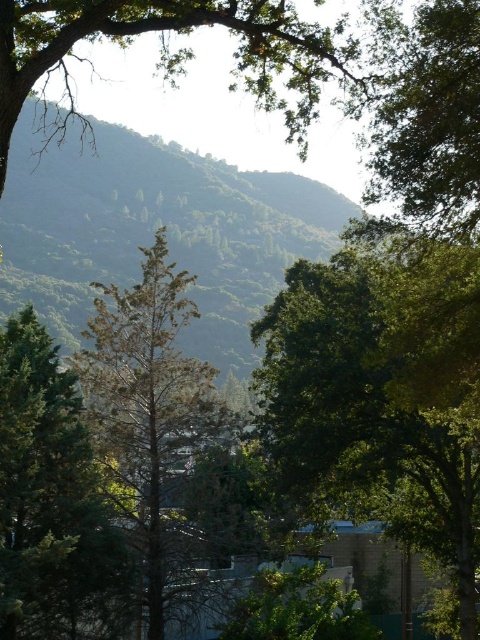
Is point (180, 300) more distant than point (395, 115)?

Yes.

Who is more forward, [156,573] or [448,216]?

Positioned in front is point [448,216].

Between point (144, 451) and point (400, 48), which one is positioned in front?

Point (400, 48) is more forward.

What are the coordinates of `green needle-like tree at center` in the screenshot? It's located at (152, 419).

Is green leafy tree at center shorter than green needle-like tree at center?

Incorrect, green leafy tree at center's height does not fall short of green needle-like tree at center's.

Can you confirm if green leafy tree at center is taller than green needle-like tree at center?

Yes.

Locate an element on the screen. The width and height of the screenshot is (480, 640). green leafy tree at center is located at coordinates (384, 388).

The height and width of the screenshot is (640, 480). I want to click on green leafy tree at center, so click(x=384, y=388).

Does green leafy mountain at center appear under green leafy tree at upper right?

No.

Is point (131, 204) positioned before point (429, 173)?

That is False.

I want to click on green leafy mountain at center, so click(x=155, y=228).